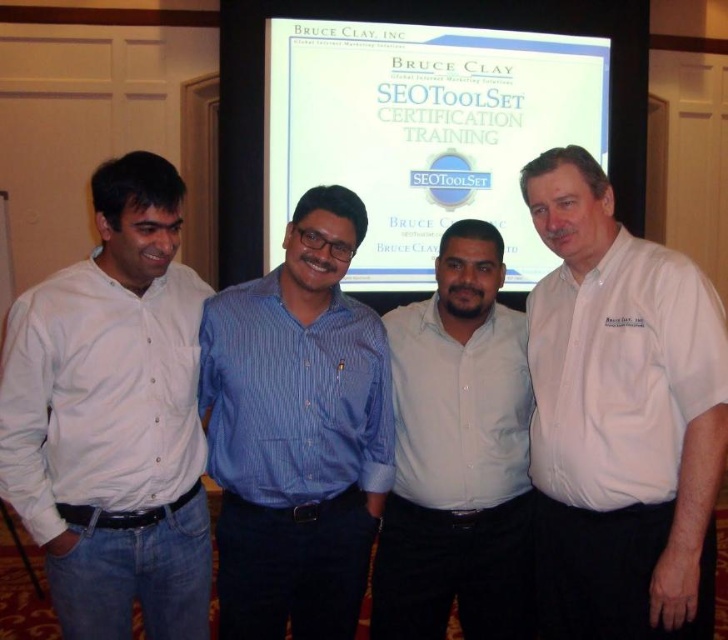
You are a photographer standing at the back of the room with a camera. You want to take a photo of the white cotton shirt at left and the white shirt at center so that both are in focus. The camera can only focus on objects within a 30 inch range. Can you capture both subjects in focus with your current camera settings?

The distance between the white cotton shirt at left and the white shirt at center is 31.99 inches. Since the camera can only focus within a 30 inch range, the subjects are slightly out of the focus range. You might need to adjust your camera settings or position to ensure both are in focus.

You are a photographer adjusting the lighting in the room. You need to ensure that the white cotton shirt at left and the white shirt at center are both visible in the photo. Which of the two should you focus on first to adjust the exposure, considering their positions?

The white cotton shirt at left is in front of the white shirt at center, so you should focus on adjusting the exposure for the white cotton shirt at left first to ensure it doesn not block the visibility of the white shirt at center behind it.